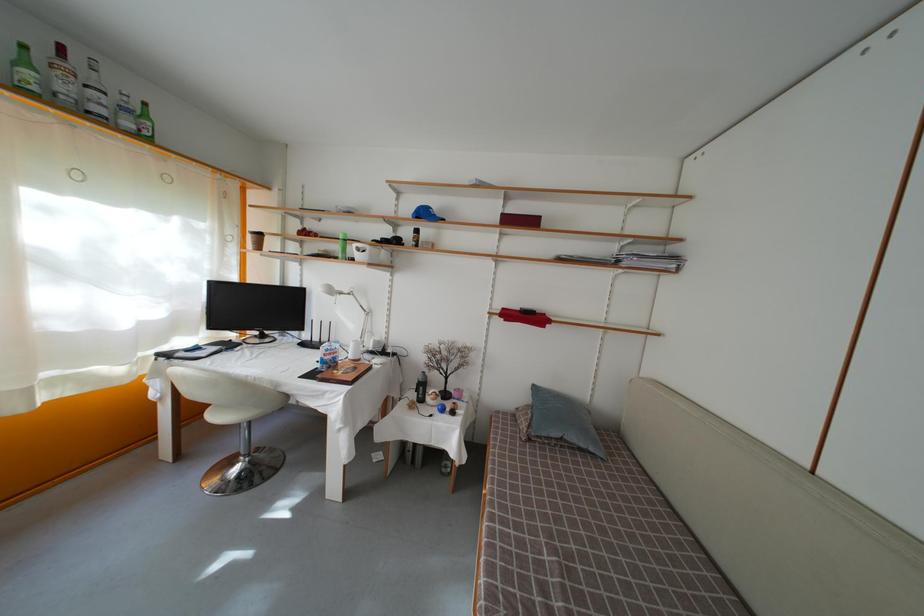
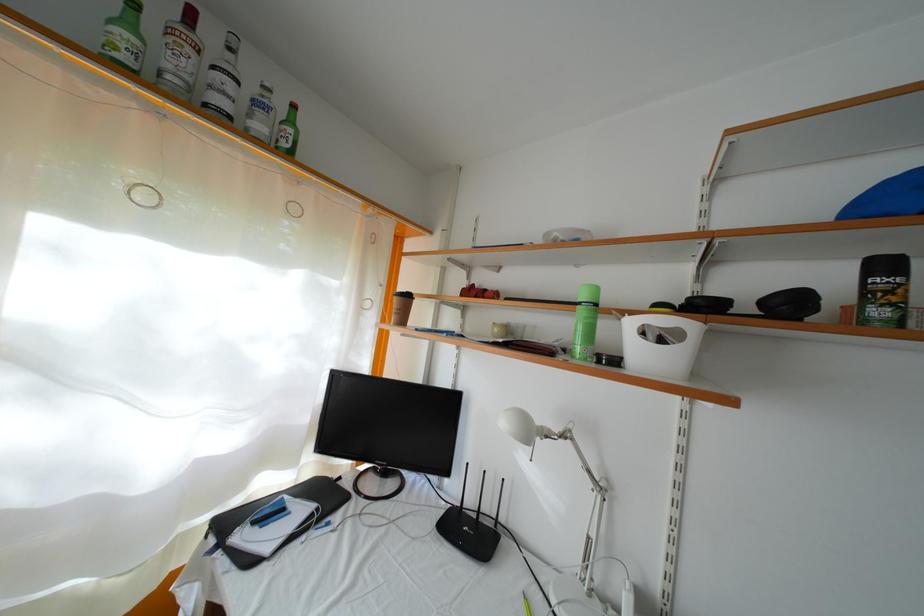
Locate, in the second image, the point that corresponds to point 337,297 in the first image.

(535, 439)